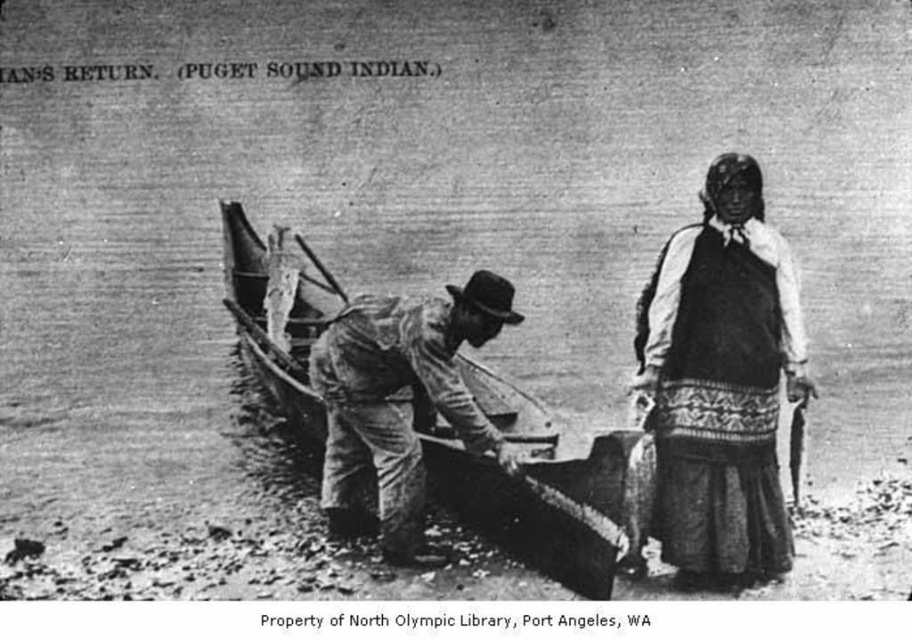
Consider the image. Based on the scene described, which object is closer to the viewer between the wooden canoe at center and the rough wooden oar at center?

The wooden canoe at center is closer to the viewer than the rough wooden oar at center because it is positioned in front of it.

You are standing at the point labeled point [496,483] and want to walk towards the point labeled point [759,234]. Which direction should you face to move directly towards it?

You should face north because point [759,234] is in front of point [496,483].